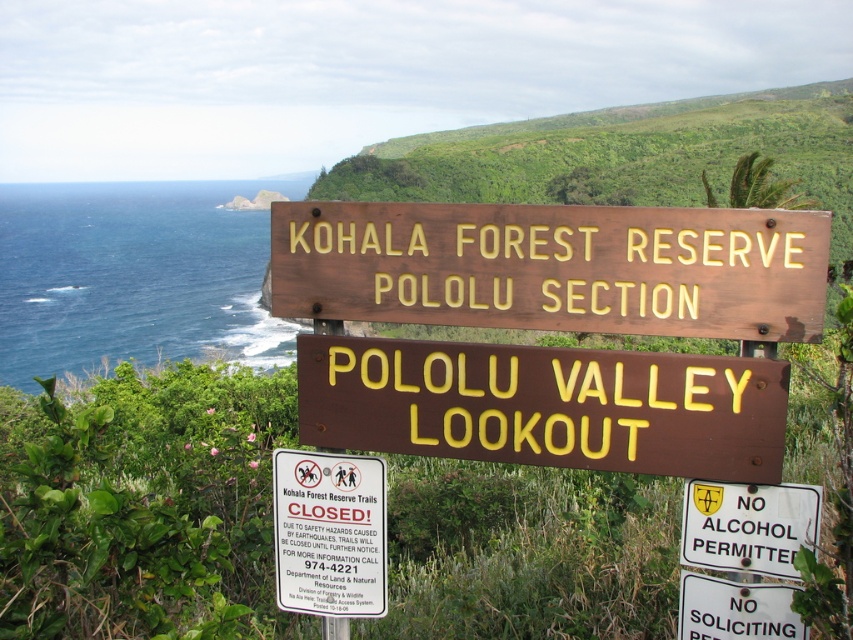
Question: Is white paper sign at center above white plastic sign at lower right?

Choices:
 (A) no
 (B) yes

Answer: (B)

Question: Considering the relative positions of white plastic sign at center and white plastic sign at lower right in the image provided, where is white plastic sign at center located with respect to white plastic sign at lower right?

Choices:
 (A) above
 (B) below

Answer: (A)

Question: Which object appears farthest from the camera in this image?

Choices:
 (A) white plastic sign at center
 (B) brown wooden sign at center

Answer: (A)

Question: Which point is closer to the camera?

Choices:
 (A) white paper sign at center
 (B) brown polished wood sign at center

Answer: (B)

Question: Based on their relative distances, which object is nearer to the white plastic sign at lower right?

Choices:
 (A) white paper sign at center
 (B) brown wooden sign at center
 (C) brown polished wood sign at center

Answer: (C)

Question: Is brown polished wood sign at center to the left of white plastic sign at lower right from the viewer's perspective?

Choices:
 (A) no
 (B) yes

Answer: (B)